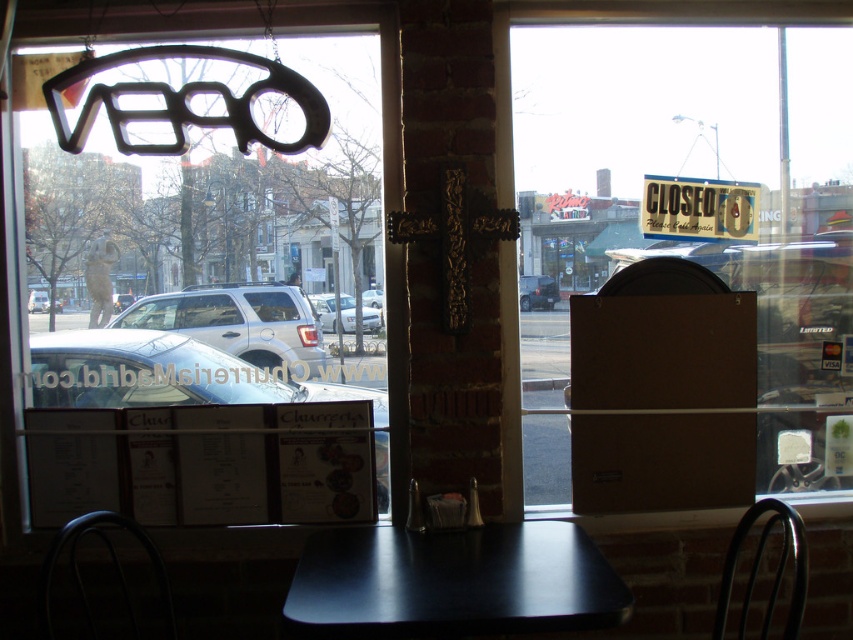
You are standing at the entrance of the restaurant and want to reach the point at coordinates point (659,177). The restaurant has a clearance height of 7 feet. Can you safely walk to that point without hitting your head?

The distance of point (659,177) from camera is 8.02 feet. Since the clearance height is 7 feet, you would hit your head if you walk there.